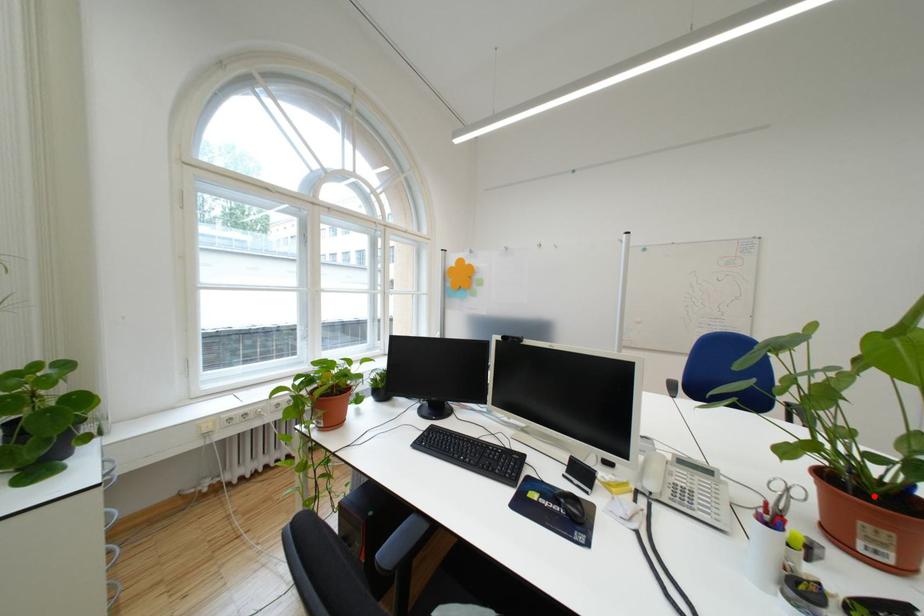
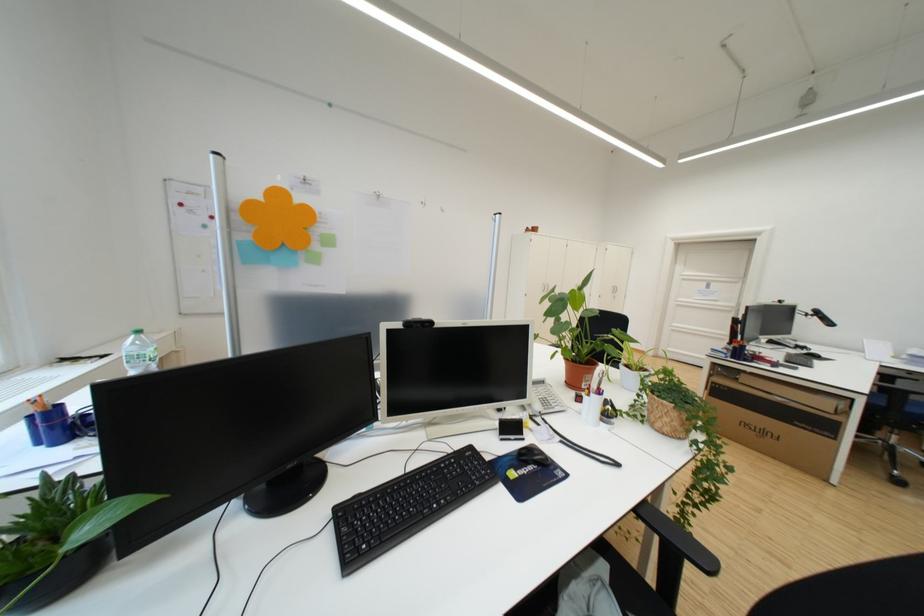
Locate, in the second image, the point that corresponds to the highlighted location in the first image.

(592, 365)